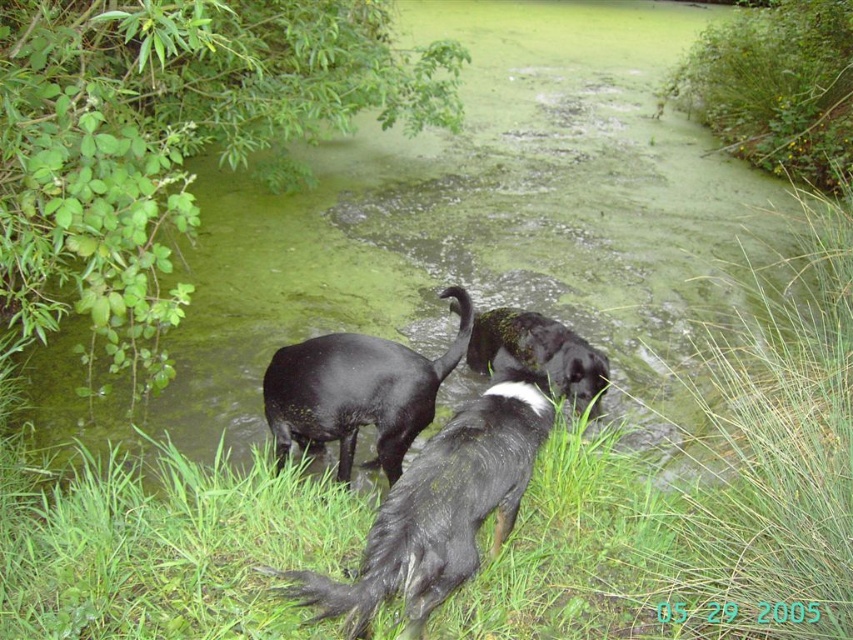
Does black fur dog at center appear under shiny black dog at center?

Answer: Indeed, black fur dog at center is positioned under shiny black dog at center.

Is point (482, 456) positioned in front of point (582, 349)?

That is True.

You are a GUI agent. You are given a task and a screenshot of the screen. Output one action in this format:
    pyautogui.click(x=<x>, y=<y>)
    Task: Click on the black fur dog at center
    Image resolution: width=853 pixels, height=640 pixels.
    Given the screenshot: What is the action you would take?
    pyautogui.click(x=440, y=508)

Does black fur dog at center have a lesser width compared to black matte dog at center?

In fact, black fur dog at center might be wider than black matte dog at center.

Between point (509, 419) and point (398, 432), which one is positioned behind?

Positioned behind is point (398, 432).

You are a GUI agent. You are given a task and a screenshot of the screen. Output one action in this format:
    pyautogui.click(x=<x>, y=<y>)
    Task: Click on the black fur dog at center
    
    Given the screenshot: What is the action you would take?
    pyautogui.click(x=440, y=508)

Who is taller, black matte dog at center or shiny black dog at center?

black matte dog at center

This screenshot has height=640, width=853. I want to click on black matte dog at center, so click(x=357, y=392).